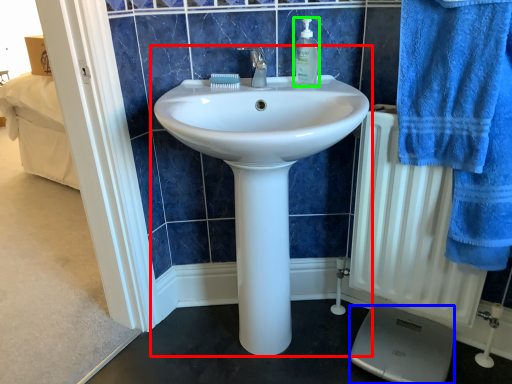
Question: Based on their relative distances, which object is farther from sink (highlighted by a red box)? Choose from scale (highlighted by a blue box) and soap dispenser (highlighted by a green box).

Choices:
 (A) scale
 (B) soap dispenser

Answer: (A)